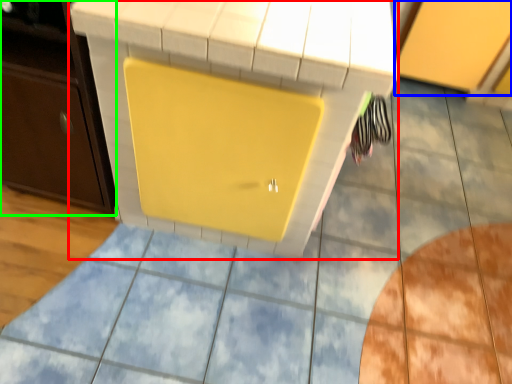
Question: Considering the real-world distances, which object is farthest from vanity (highlighted by a red box)? cabinetry (highlighted by a blue box) or cabinetry (highlighted by a green box)?

Choices:
 (A) cabinetry
 (B) cabinetry

Answer: (A)